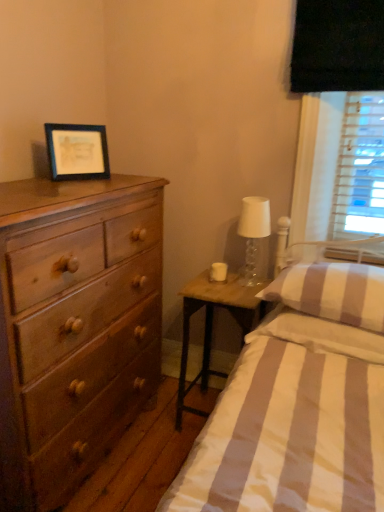
Describe the element at coordinates (253, 234) in the screenshot. I see `translucent glass lampshade at right` at that location.

What is the approximate width of striped fabric pillow at right, which is counted as the first pillow, starting from the top?

19.53 inches.

This screenshot has width=384, height=512. I want to click on striped fabric pillow at right, which is counted as the first pillow, starting from the top, so pyautogui.click(x=333, y=293).

This screenshot has height=512, width=384. Describe the element at coordinates (212, 325) in the screenshot. I see `woodennightstand at right` at that location.

Measure the distance between point (x=206, y=272) and camera.

Point (x=206, y=272) is 7.26 feet away from camera.

What are the coordinates of `translucent glass lampshade at right` in the screenshot? It's located at (253, 234).

Consider the image. Are woodennightstand at right and matte black picture frame at upper left beside each other?

There is a gap between woodennightstand at right and matte black picture frame at upper left.

Considering the relative sizes of woodennightstand at right and matte black picture frame at upper left in the image provided, is woodennightstand at right smaller than matte black picture frame at upper left?

No.

Which of these two, woodennightstand at right or matte black picture frame at upper left, is wider?

With larger width is woodennightstand at right.

Is woodennightstand at right inside or outside of matte black picture frame at upper left?

woodennightstand at right lies outside matte black picture frame at upper left.

Considering the relative sizes of striped fabric pillow at right, the 2th pillow in the top-to-bottom sequence, and matte brown dresser at left in the image provided, is striped fabric pillow at right, the 2th pillow in the top-to-bottom sequence, thinner than matte brown dresser at left?

Yes.

Looking at this image, how far apart are striped fabric pillow at right, the 1th pillow from the bottom, and matte brown dresser at left?

striped fabric pillow at right, the 1th pillow from the bottom, and matte brown dresser at left are 28.73 inches apart.

Based on the photo, can you confirm if striped fabric pillow at right, the 1th pillow from the bottom, is smaller than matte brown dresser at left?

Correct, striped fabric pillow at right, the 1th pillow from the bottom, occupies less space than matte brown dresser at left.

From the image's perspective, is striped fabric pillow at right, the 1th pillow from the bottom, over matte brown dresser at left?

Correct, striped fabric pillow at right, the 1th pillow from the bottom, appears higher than matte brown dresser at left in the image.

Is woodennightstand at right oriented towards striped cotton bed at center?

No, woodennightstand at right is not oriented towards striped cotton bed at center.

Which is behind, woodennightstand at right or striped cotton bed at center?

Positioned behind is woodennightstand at right.

Between point (191, 290) and point (371, 295), which one is positioned behind?

The point (191, 290) is more distant.

From the image's perspective, is matte brown dresser at left positioned above or below white glass candle holder at right?

matte brown dresser at left is situated lower than white glass candle holder at right in the image.

Which object is closer to the camera, matte brown dresser at left or white glass candle holder at right?

matte brown dresser at left is more forward.

Which of these two, matte brown dresser at left or white glass candle holder at right, is wider?

matte brown dresser at left.

Is matte brown dresser at left aimed at white glass candle holder at right?

Yes, matte brown dresser at left faces towards white glass candle holder at right.

Considering the relative sizes of striped fabric pillow at right, which is counted as the first pillow, starting from the top, and striped cotton bed at center in the image provided, is striped fabric pillow at right, which is counted as the first pillow, starting from the top, smaller than striped cotton bed at center?

Indeed, striped fabric pillow at right, which is counted as the first pillow, starting from the top, has a smaller size compared to striped cotton bed at center.

Image resolution: width=384 pixels, height=512 pixels. I want to click on bed below the striped fabric pillow at right, which is counted as the first pillow, starting from the top (from a real-world perspective), so click(x=299, y=404).

How far apart are striped fabric pillow at right, which is counted as the first pillow, starting from the top, and striped cotton bed at center?

striped fabric pillow at right, which is counted as the first pillow, starting from the top, is 17.57 centimeters from striped cotton bed at center.

Between striped fabric pillow at right, which is the 2th pillow in bottom-to-top order, and striped cotton bed at center, which one has more height?

striped cotton bed at center.

Is matte brown dresser at left at the right side of striped fabric pillow at right, the 2th pillow in the top-to-bottom sequence?

No.

Who is bigger, matte brown dresser at left or striped fabric pillow at right, the 1th pillow from the bottom?

Bigger between the two is matte brown dresser at left.

From a real-world perspective, between matte brown dresser at left and striped fabric pillow at right, the 2th pillow in the top-to-bottom sequence, who is vertically lower?

From a 3D spatial view, matte brown dresser at left is below.

From the image's perspective, relative to striped cotton bed at center, is white glass candle holder at right above or below?

From the image's perspective, white glass candle holder at right appears above striped cotton bed at center.

Find the location of a particular element. bed in front of the white glass candle holder at right is located at coordinates [x=299, y=404].

Which of these two, white glass candle holder at right or striped cotton bed at center, is thinner?

white glass candle holder at right is thinner.

Which object is positioned more to the right, white glass candle holder at right or striped cotton bed at center?

striped cotton bed at center is more to the right.

Locate an element on the screen. nightstand below the matte black picture frame at upper left (from the image's perspective) is located at coordinates (212, 325).

Where is `the 2nd pillow to the right of the matte brown dresser at left, starting your count from the anchor`? The image size is (384, 512). the 2nd pillow to the right of the matte brown dresser at left, starting your count from the anchor is located at coordinates point(320,334).

Which object lies further to the anchor point striped fabric pillow at right, the 2th pillow in the top-to-bottom sequence, striped cotton bed at center or striped fabric pillow at right, which is counted as the first pillow, starting from the top?

striped cotton bed at center lies further to striped fabric pillow at right, the 2th pillow in the top-to-bottom sequence, than the other object.

Which object lies further to the anchor point woodennightstand at right, striped fabric pillow at right, which is counted as the first pillow, starting from the top, or matte black picture frame at upper left?

Among the two, matte black picture frame at upper left is located further to woodennightstand at right.

Estimate the real-world distances between objects in this image. Which object is further from translucent glass lampshade at right, matte brown dresser at left or matte black picture frame at upper left?

Among the two, matte brown dresser at left is located further to translucent glass lampshade at right.

Estimate the real-world distances between objects in this image. Which object is closer to striped fabric pillow at right, the 1th pillow from the bottom, matte black picture frame at upper left or striped cotton bed at center?

The object closer to striped fabric pillow at right, the 1th pillow from the bottom, is striped cotton bed at center.

Considering their positions, is woodennightstand at right positioned further to white glass candle holder at right than striped fabric pillow at right, the 1th pillow from the bottom?

striped fabric pillow at right, the 1th pillow from the bottom.

Looking at the image, which one is located closer to matte brown dresser at left, striped fabric pillow at right, which is counted as the first pillow, starting from the top, or matte black picture frame at upper left?

Based on the image, matte black picture frame at upper left appears to be nearer to matte brown dresser at left.

Estimate the real-world distances between objects in this image. Which object is closer to striped cotton bed at center, white glass candle holder at right or matte black picture frame at upper left?

Among the two, white glass candle holder at right is located nearer to striped cotton bed at center.

Estimate the real-world distances between objects in this image. Which object is closer to matte black picture frame at upper left, translucent glass lampshade at right or striped cotton bed at center?

translucent glass lampshade at right.

The height and width of the screenshot is (512, 384). Find the location of `pillow situated between matte brown dresser at left and striped fabric pillow at right, the 1th pillow from the bottom, from left to right`. pillow situated between matte brown dresser at left and striped fabric pillow at right, the 1th pillow from the bottom, from left to right is located at coordinates (333, 293).

Locate an element on the screen. This screenshot has height=512, width=384. the chest of drawers positioned between striped cotton bed at center and translucent glass lampshade at right from near to far is located at coordinates (74, 327).

The height and width of the screenshot is (512, 384). In order to click on nightstand between matte brown dresser at left and translucent glass lampshade at right from front to back in this screenshot , I will do `click(212, 325)`.

The image size is (384, 512). Identify the location of candle holder between matte black picture frame at upper left and translucent glass lampshade at right in the horizontal direction. (218, 272).